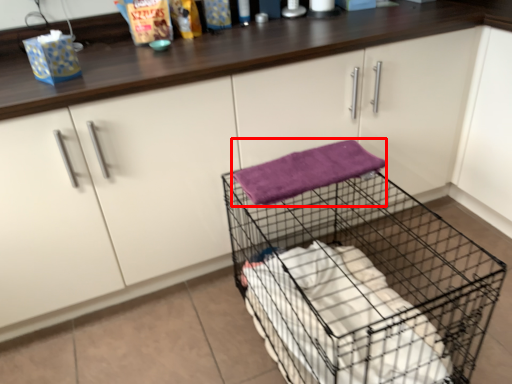
Question: From the image's perspective, what is the correct spatial relationship of bath towel (annotated by the red box) in relation to trolley?

Choices:
 (A) below
 (B) above

Answer: (B)